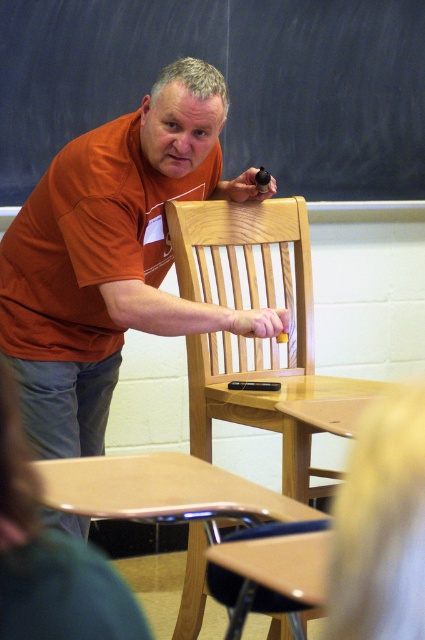
In the scene shown: You are a student sitting in the wooden chair at center. Looking forward, which side of you is the black chalkboard at upper center located?

The black chalkboard at upper center is located to the left side of the wooden chair at center.